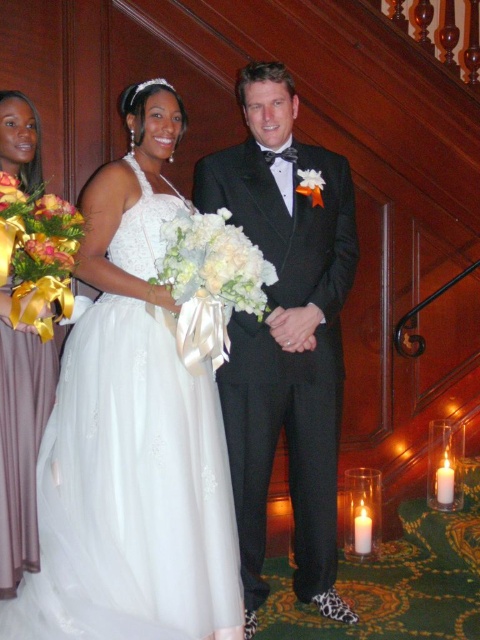
Does black satin tuxedo at center have a larger size compared to mauve satin dress at left?

Indeed, black satin tuxedo at center has a larger size compared to mauve satin dress at left.

Locate an element on the screen. The width and height of the screenshot is (480, 640). black satin tuxedo at center is located at coordinates (285, 333).

Identify the location of white tulle dress at center. This screenshot has height=640, width=480. (131, 492).

Between white silk bouquet at center and yellow satin ribbon at left, which one has less height?

yellow satin ribbon at left is shorter.

Does white silk bouquet at center have a greater width compared to yellow satin ribbon at left?

Correct, the width of white silk bouquet at center exceeds that of yellow satin ribbon at left.

Find the location of a particular element. white silk bouquet at center is located at coordinates (214, 262).

Where is `white silk bouquet at center`? This screenshot has width=480, height=640. white silk bouquet at center is located at coordinates pos(214,262).